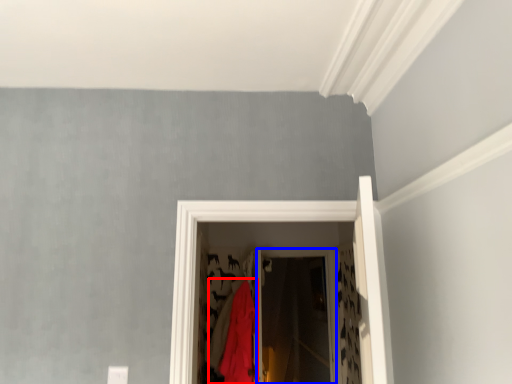
Question: Among these objects, which one is farthest to the camera, clothing (highlighted by a red box) or screen door (highlighted by a blue box)?

Choices:
 (A) clothing
 (B) screen door

Answer: (B)